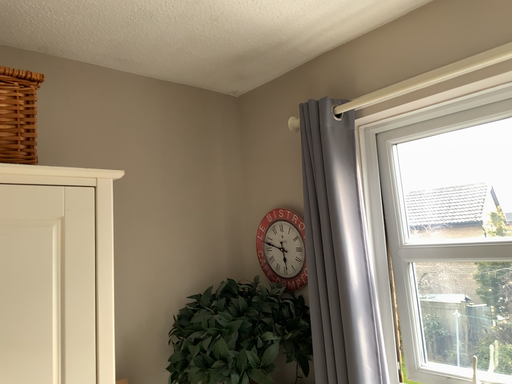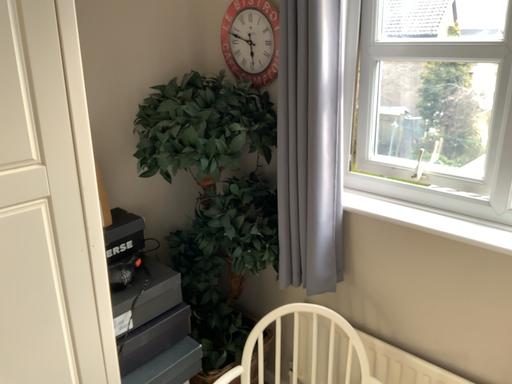
Question: How did the camera likely rotate when shooting the video?

Choices:
 (A) rotated upward
 (B) rotated downward

Answer: (B)